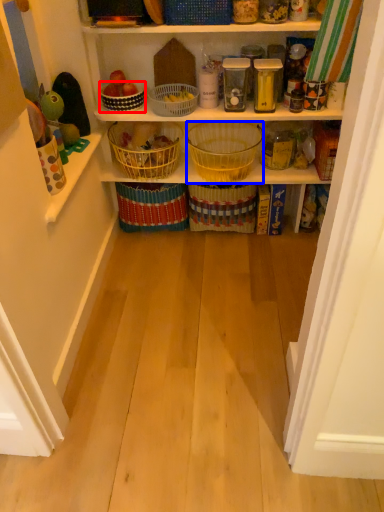
Question: Which point is closer to the camera, basket (highlighted by a red box) or basket (highlighted by a blue box)?

Choices:
 (A) basket
 (B) basket

Answer: (B)